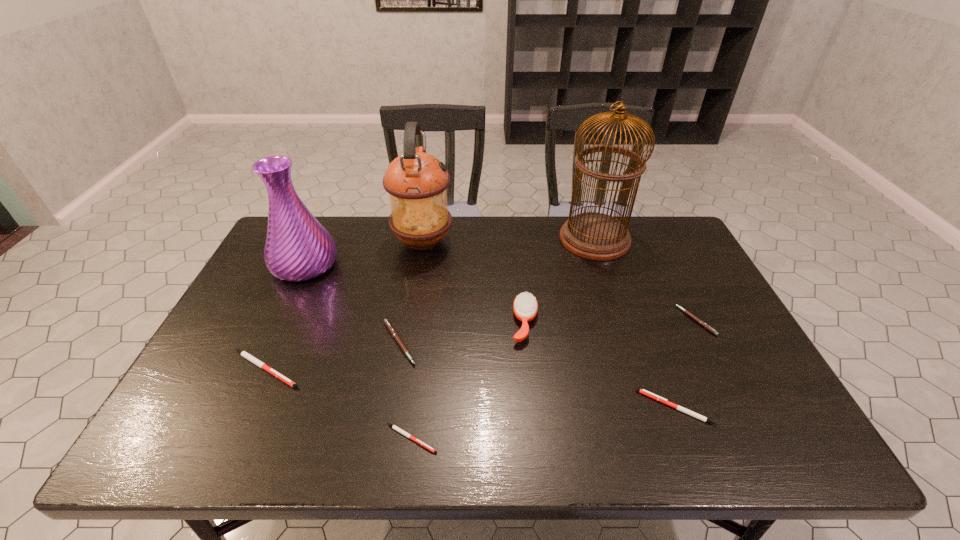
Find the location of `free spot between the rightmost white pen and the oil lamp`. free spot between the rightmost white pen and the oil lamp is located at coordinates (549, 325).

Locate an element on the screen. The width and height of the screenshot is (960, 540). free spot between the rightmost pen and the birdcage is located at coordinates (645, 280).

Identify the location of object that is the fifth closest one to the seventh shortest object. The image size is (960, 540). (525, 306).

The image size is (960, 540). I want to click on object that is the fourth closest to the leftmost white pen, so click(417, 182).

Find the location of a particular element. This screenshot has width=960, height=540. pen that is the fourth closest to the seventh shortest object is located at coordinates (644, 392).

Where is `the closest pen to the right pink pen`? the closest pen to the right pink pen is located at coordinates (644, 392).

Where is `the third closest white pen to the left pink pen`? This screenshot has width=960, height=540. the third closest white pen to the left pink pen is located at coordinates (644, 392).

The width and height of the screenshot is (960, 540). I want to click on white pen that is the nearest to the oil lamp, so click(246, 355).

Find the location of a particular element. blank space that satisfies the following two spatial constraints: 1. on the front side of the oil lamp; 2. at the nib of the bigger pink pen is located at coordinates (406, 343).